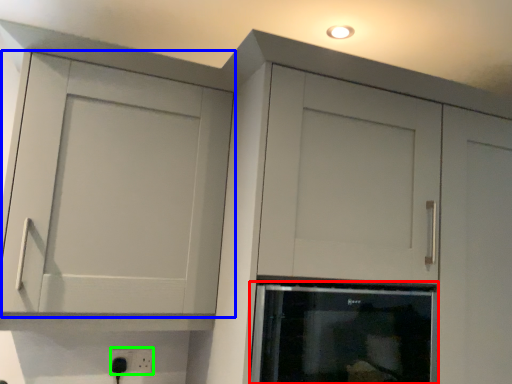
Question: Based on their relative distances, which object is nearer to appliance (highlighted by a red box)? Choose from cupboard (highlighted by a blue box) and electric outlet (highlighted by a green box).

Choices:
 (A) cupboard
 (B) electric outlet

Answer: (A)